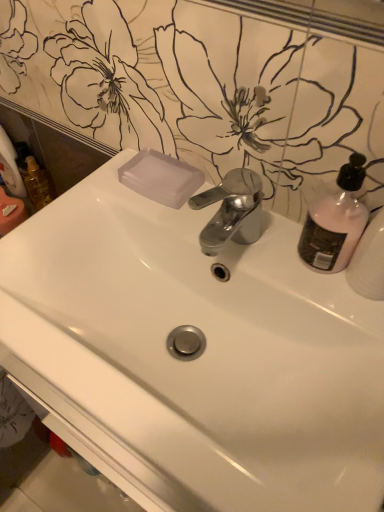
Question: Considering the relative sizes of translucent plastic soap at upper center and pink matte bottle at upper right in the image provided, is translucent plastic soap at upper center bigger than pink matte bottle at upper right?

Choices:
 (A) no
 (B) yes

Answer: (A)

Question: Is translucent plastic soap at upper center shorter than pink matte bottle at upper right?

Choices:
 (A) yes
 (B) no

Answer: (A)

Question: Does translucent plastic soap at upper center have a lesser width compared to pink matte bottle at upper right?

Choices:
 (A) no
 (B) yes

Answer: (A)

Question: Considering the relative positions of translucent plastic soap at upper center and pink matte bottle at upper right in the image provided, is translucent plastic soap at upper center to the left of pink matte bottle at upper right from the viewer's perspective?

Choices:
 (A) no
 (B) yes

Answer: (B)

Question: Is translucent plastic soap at upper center wider than pink matte bottle at upper right?

Choices:
 (A) no
 (B) yes

Answer: (B)

Question: Is white matte toilet paper at left to the left or to the right of pink matte bottle at upper right in the image?

Choices:
 (A) left
 (B) right

Answer: (A)

Question: Considering the positions of white matte toilet paper at left and pink matte bottle at upper right in the image, is white matte toilet paper at left taller or shorter than pink matte bottle at upper right?

Choices:
 (A) tall
 (B) short

Answer: (A)

Question: Looking at the image, does white matte toilet paper at left seem bigger or smaller compared to pink matte bottle at upper right?

Choices:
 (A) small
 (B) big

Answer: (A)

Question: From the image's perspective, is white matte toilet paper at left above or below pink matte bottle at upper right?

Choices:
 (A) below
 (B) above

Answer: (B)

Question: From the image's perspective, is translucent plastic mouthwash at left above or below pink matte bottle at upper right?

Choices:
 (A) above
 (B) below

Answer: (A)

Question: Is point (48, 199) positioned closer to the camera than point (350, 248)?

Choices:
 (A) farther
 (B) closer

Answer: (A)

Question: From a real-world perspective, relative to pink matte bottle at upper right, is translucent plastic mouthwash at left vertically above or below?

Choices:
 (A) below
 (B) above

Answer: (A)

Question: Relative to pink matte bottle at upper right, is translucent plastic mouthwash at left in front or behind?

Choices:
 (A) behind
 (B) front

Answer: (A)

Question: Is translucent plastic soap at upper center inside the boundaries of white glossy sink at center, or outside?

Choices:
 (A) outside
 (B) inside

Answer: (B)

Question: Is translucent plastic soap at upper center taller or shorter than white glossy sink at center?

Choices:
 (A) short
 (B) tall

Answer: (A)